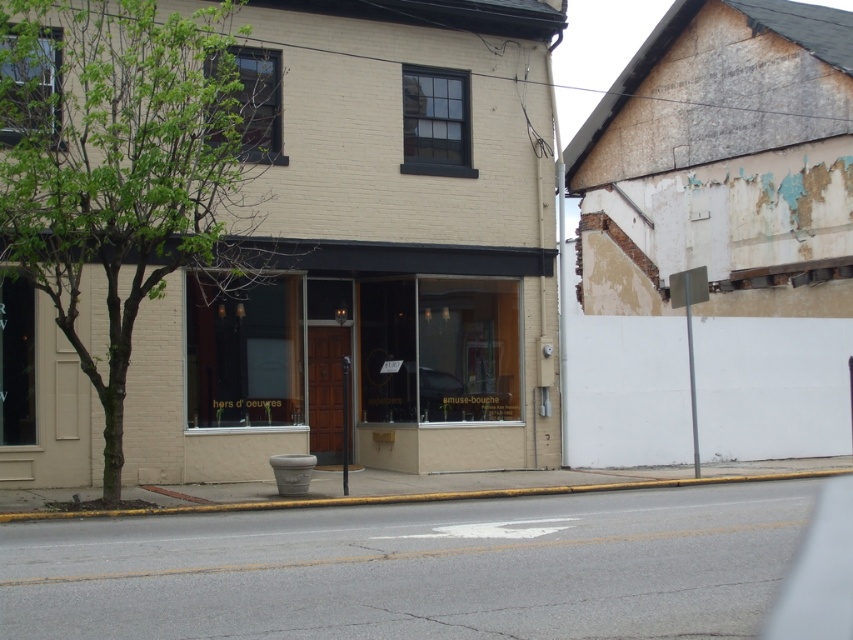
Which is below, green leafy tree at left or yellow concrete curb at lower center?

yellow concrete curb at lower center is below.

Does green leafy tree at left appear under yellow concrete curb at lower center?

Actually, green leafy tree at left is above yellow concrete curb at lower center.

Who is more distant from viewer, (119, 355) or (614, 484)?

The point (614, 484) is more distant.

Where is `green leafy tree at left`? Image resolution: width=853 pixels, height=640 pixels. green leafy tree at left is located at coordinates (123, 164).

Does green leafy tree at left lie in front of matte glass storefront at center?

Yes, green leafy tree at left is in front of matte glass storefront at center.

Who is positioned more to the left, green leafy tree at left or matte glass storefront at center?

From the viewer's perspective, green leafy tree at left appears more on the left side.

Is point (97, 29) closer to camera compared to point (258, 344)?

Yes.

You are a GUI agent. You are given a task and a screenshot of the screen. Output one action in this format:
    pyautogui.click(x=<x>, y=<y>)
    Task: Click on the green leafy tree at left
    Image resolution: width=853 pixels, height=640 pixels.
    Given the screenshot: What is the action you would take?
    pyautogui.click(x=123, y=164)

Between matte glass storefront at center and yellow concrete curb at lower center, which one is positioned lower?

Positioned lower is yellow concrete curb at lower center.

Is point (322, 428) positioned in front of point (436, 492)?

No, (322, 428) is behind (436, 492).

The height and width of the screenshot is (640, 853). I want to click on matte glass storefront at center, so click(x=379, y=358).